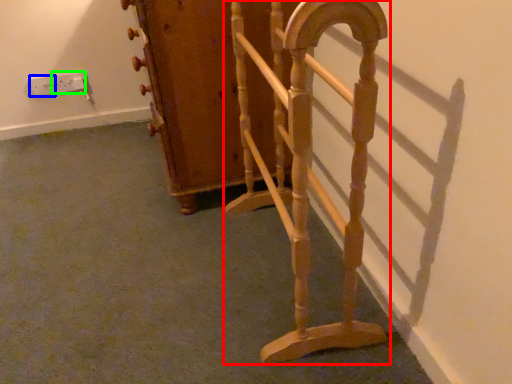
Question: Which object is positioned closest to furniture (highlighted by a red box)? Select from electric outlet (highlighted by a blue box) and electric outlet (highlighted by a green box).

Choices:
 (A) electric outlet
 (B) electric outlet

Answer: (B)